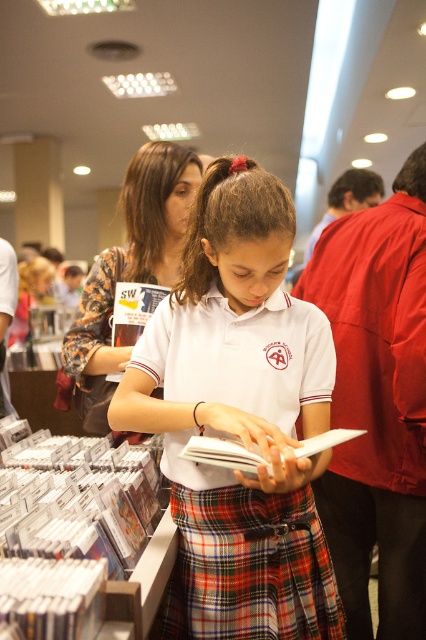
Measure the distance between point (259, 557) and camera.

1.14 meters

Who is more forward, (227, 566) or (216, 456)?

Point (216, 456)

Identify the location of plaid fabric kilt at center. (249, 568).

Which is more to the left, white cotton shirt at center or white matte book at center?

From the viewer's perspective, white cotton shirt at center appears more on the left side.

Is point (239, 168) farther from camera compared to point (230, 440)?

Yes, it is behind point (230, 440).

Identify the location of white cotton shirt at center. The image size is (426, 640). (239, 419).

Does point (282, 234) come closer to viewer compared to point (187, 508)?

Yes.

Is white cotton shirt at center in front of plaid fabric kilt at center?

Yes, it is in front of plaid fabric kilt at center.

Measure the distance between point (290, 632) and camera.

Point (290, 632) and camera are 3.71 feet apart.

Image resolution: width=426 pixels, height=640 pixels. Find the location of `white cotton shirt at center`. white cotton shirt at center is located at coordinates (239, 419).